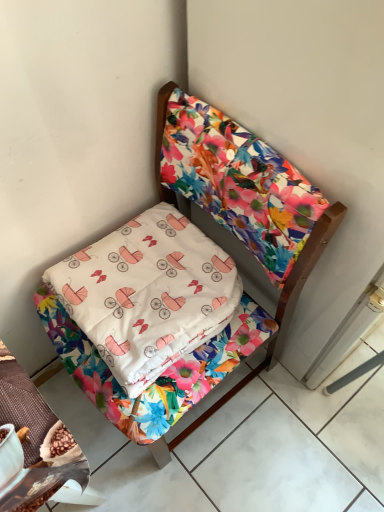
Question: Does point (274, 352) appear closer or farther from the camera than point (115, 369)?

Choices:
 (A) closer
 (B) farther

Answer: (B)

Question: In the image, is floral fabric bed at upper right on the left side or the right side of white cotton pillow at center?

Choices:
 (A) left
 (B) right

Answer: (B)

Question: Looking at the image, does floral fabric bed at upper right seem bigger or smaller compared to white cotton pillow at center?

Choices:
 (A) big
 (B) small

Answer: (A)

Question: Based on their sizes in the image, would you say white cotton pillow at center is bigger or smaller than floral fabric bed at upper right?

Choices:
 (A) small
 (B) big

Answer: (A)

Question: From a real-world perspective, is white cotton pillow at center positioned above or below floral fabric bed at upper right?

Choices:
 (A) above
 (B) below

Answer: (A)

Question: From the image's perspective, is white cotton pillow at center located above or below floral fabric bed at upper right?

Choices:
 (A) below
 (B) above

Answer: (B)

Question: Considering the positions of white cotton pillow at center and floral fabric bed at upper right in the image, is white cotton pillow at center taller or shorter than floral fabric bed at upper right?

Choices:
 (A) short
 (B) tall

Answer: (A)